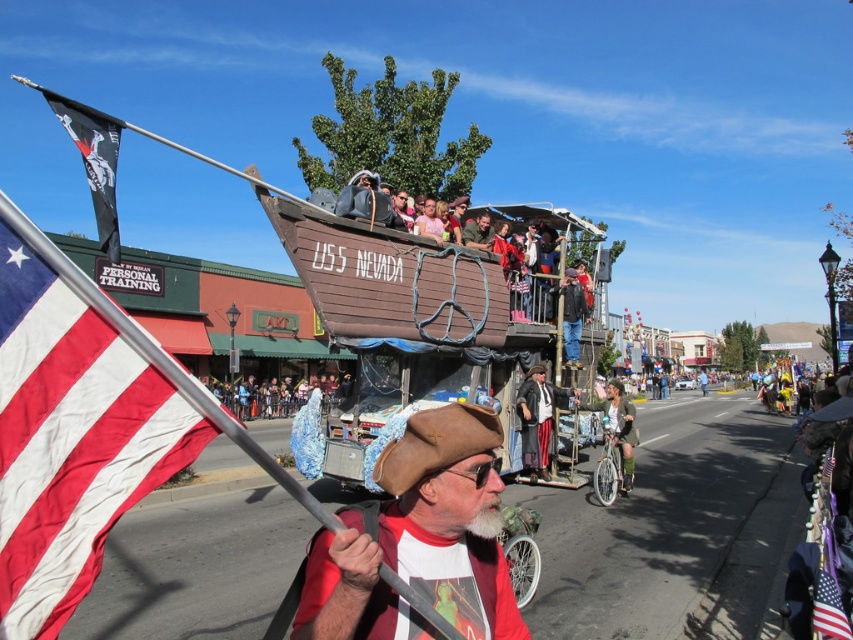
You are a photographer trying to capture a photo of both the brown leather hat at center and the shiny black pirate costume at center in the same frame. Given that your camera has a maximum focal length that allows capturing objects up to 10 meters apart, will you be able to include both in the photo?

The brown leather hat at center and the shiny black pirate costume at center are 9.03 meters apart from each other. Since the maximum focal length allows capturing objects up to 10 meters apart, yes, both can be included in the photo as 9.03 meters is within the 10 meter limit.

You are a photographer trying to capture the blue fabric at center in your shot. Based on its position, where should you aim your camera?

The blue fabric at center is located at coordinates point (x=270, y=397), so aim your camera there to capture it.

You are a photographer taking a picture of the blue fabric at center and the green fabric jacket at center. Which one should you focus on first if you want to capture both in sharp focus?

The blue fabric at center is located below the green fabric jacket at center, so you should focus on the green fabric jacket at center first since it is closer to the camera.